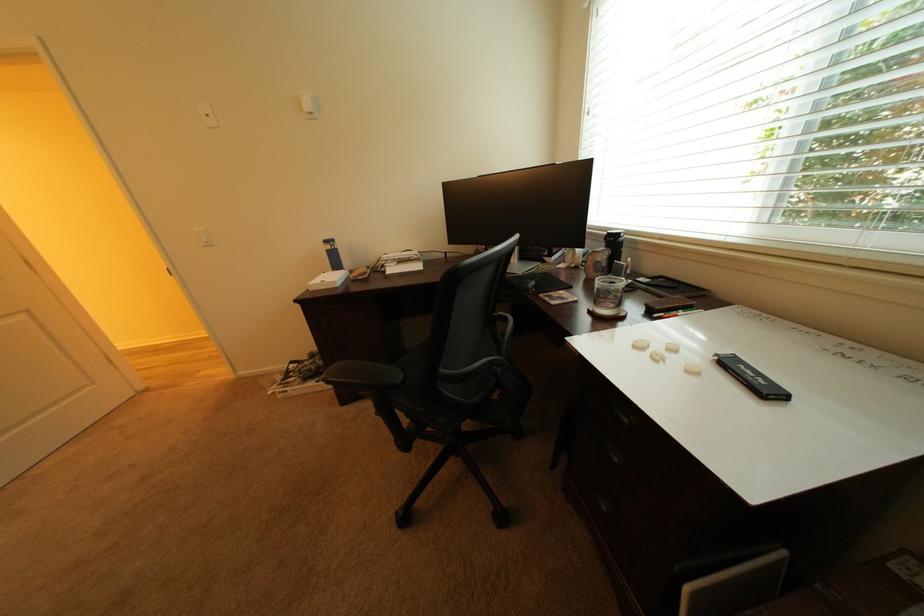
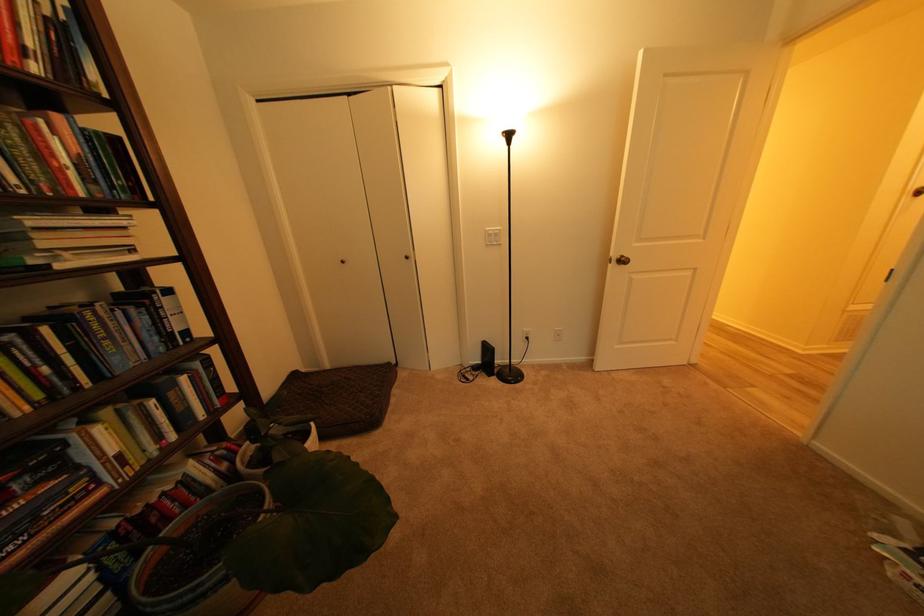
First-person continuous shooting, in which direction is the camera rotating?

→ The rotation direction of the camera is left-down.